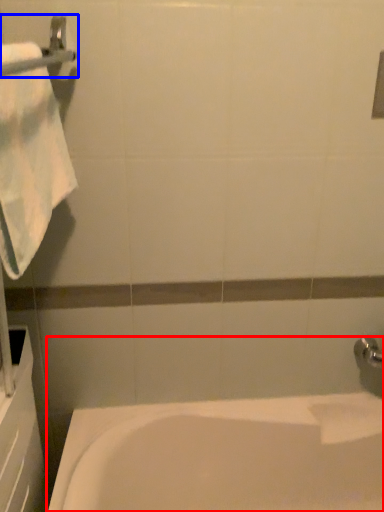
Question: Which object appears closest to the camera in this image, bathtub (highlighted by a red box) or towel bar (highlighted by a blue box)?

Choices:
 (A) bathtub
 (B) towel bar

Answer: (B)